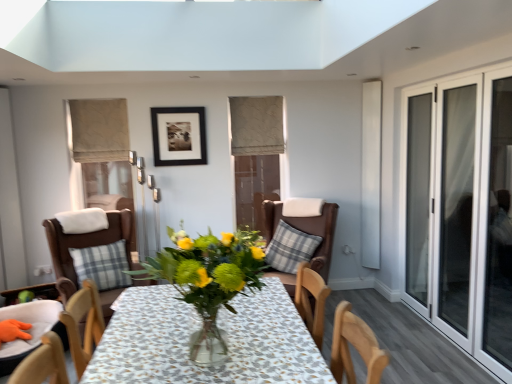
Find the location of a particular element. This screenshot has width=512, height=384. brown leather chair at left, the second chair in the right-to-left sequence is located at coordinates (93, 255).

What is the approximate height of wooden chair at lower left, which is counted as the 1th chair, starting from the left?

13.66 inches.

You are a GUI agent. You are given a task and a screenshot of the screen. Output one action in this format:
    pyautogui.click(x=<x>, y=<y>)
    Task: Click on the wooden chair at lower left, the third chair when ordered from right to left
    
    Given the screenshot: What is the action you would take?
    pyautogui.click(x=30, y=330)

The height and width of the screenshot is (384, 512). What do you see at coordinates (418, 195) in the screenshot? I see `transparent glass door at right` at bounding box center [418, 195].

Based on the photo, what is the approximate height of beige fabric curtain at upper left, which ranks as the 1th curtain in front-to-back order?

56.44 centimeters.

I want to click on beige fabric curtain at upper left, the second curtain positioned from the right, so click(x=99, y=130).

Where is `transparent glass screen door at right`? The image size is (512, 384). transparent glass screen door at right is located at coordinates (456, 204).

What do you see at coordinates (456, 204) in the screenshot? The image size is (512, 384). I see `transparent glass screen door at right` at bounding box center [456, 204].

Identify the location of transparent glass sliding door at right. coord(461,211).

The width and height of the screenshot is (512, 384). Identify the location of plaid fabric pillow at left, the 1th pillow positioned from the left. (102, 265).

In the scene shown: Can you see black matte picture frame at upper center touching brown leather chair at left, the second chair in the right-to-left sequence?

black matte picture frame at upper center and brown leather chair at left, the second chair in the right-to-left sequence, are not in contact.

How many degrees apart are the facing directions of black matte picture frame at upper center and brown leather chair at left, which is counted as the second chair, starting from the left?

The facing directions of black matte picture frame at upper center and brown leather chair at left, which is counted as the second chair, starting from the left, are 27.5 degrees apart.

Which is farther from the camera, (184, 162) or (89, 276)?

The point (184, 162) is farther.

You are a GUI agent. You are given a task and a screenshot of the screen. Output one action in this format:
    pyautogui.click(x=<x>, y=<y>)
    Task: Click on the chair that is the 2nd one when counting forward from the black matte picture frame at upper center
    This screenshot has height=384, width=512.
    Given the screenshot: What is the action you would take?
    pyautogui.click(x=93, y=255)

Considering the relative sizes of black matte picture frame at upper center and plaid fabric pillow at left, the 1th pillow positioned from the left, in the image provided, is black matte picture frame at upper center smaller than plaid fabric pillow at left, the 1th pillow positioned from the left,?

Correct, black matte picture frame at upper center occupies less space than plaid fabric pillow at left, the 1th pillow positioned from the left.

Would you say black matte picture frame at upper center is outside plaid fabric pillow at left, which is counted as the second pillow, starting from the right?

Indeed, black matte picture frame at upper center is completely outside plaid fabric pillow at left, which is counted as the second pillow, starting from the right.

From the image's perspective, is black matte picture frame at upper center positioned above or below plaid fabric pillow at left, the 1th pillow positioned from the left?

Clearly, from the image's perspective, black matte picture frame at upper center is above plaid fabric pillow at left, the 1th pillow positioned from the left.

Between black matte picture frame at upper center and plaid fabric pillow at left, the 1th pillow positioned from the left, which one has smaller width?

With smaller width is black matte picture frame at upper center.

Considering their positions, is plaid fabric pillow at left, the 1th pillow positioned from the left, located in front of or behind transparent glass sliding door at right?

plaid fabric pillow at left, the 1th pillow positioned from the left, is behind transparent glass sliding door at right.

Can you confirm if plaid fabric pillow at left, which is counted as the second pillow, starting from the right, is thinner than transparent glass sliding door at right?

Incorrect, the width of plaid fabric pillow at left, which is counted as the second pillow, starting from the right, is not less than that of transparent glass sliding door at right.

Can you confirm if plaid fabric pillow at left, the 1th pillow positioned from the left, is bigger than transparent glass sliding door at right?

No.

Identify the location of window that appears above the plaid fabric pillow at left, which is counted as the second pillow, starting from the right (from a real-world perspective). (461, 211).

Could you tell me if transparent glass screen door at right is turned towards beige fabric curtain at upper center, the first curtain in the right-to-left sequence?

No.

Which object is thinner, transparent glass screen door at right or beige fabric curtain at upper center, marked as the second curtain in a front-to-back arrangement?

Thinner between the two is transparent glass screen door at right.

Is transparent glass screen door at right in contact with beige fabric curtain at upper center, marked as the second curtain in a front-to-back arrangement?

There is a gap between transparent glass screen door at right and beige fabric curtain at upper center, marked as the second curtain in a front-to-back arrangement.

Who is shorter, transparent glass screen door at right or beige fabric curtain at upper center, which appears as the 2th curtain when viewed from the left?

beige fabric curtain at upper center, which appears as the 2th curtain when viewed from the left, is shorter.

How far apart are plaid fabric pillow at center, which is the first pillow in right-to-left order, and transparent glass screen door at right?

The distance of plaid fabric pillow at center, which is the first pillow in right-to-left order, from transparent glass screen door at right is 1.30 meters.

Is plaid fabric pillow at center, which is the first pillow in right-to-left order, wider or thinner than transparent glass screen door at right?

plaid fabric pillow at center, which is the first pillow in right-to-left order, is wider than transparent glass screen door at right.

From the image's perspective, which object appears higher, plaid fabric pillow at center, which is the first pillow in right-to-left order, or transparent glass screen door at right?

transparent glass screen door at right.

Which object is thinner, beige fabric curtain at upper left, the second curtain positioned from the right, or wooden chair at lower left, the third chair when ordered from right to left?

beige fabric curtain at upper left, the second curtain positioned from the right, is thinner.

From the picture: From the image's perspective, who appears lower, beige fabric curtain at upper left, which ranks as the 1th curtain in front-to-back order, or wooden chair at lower left, the third chair when ordered from right to left?

From the image's view, wooden chair at lower left, the third chair when ordered from right to left, is below.

Does beige fabric curtain at upper left, positioned as the 2th curtain in back-to-front order, appear on the right side of wooden chair at lower left, which is counted as the 1th chair, starting from the left?

Yes.

Consider the image. How much distance is there between beige fabric curtain at upper left, positioned as the 2th curtain in back-to-front order, and wooden chair at lower left, the third chair when ordered from right to left?

The distance of beige fabric curtain at upper left, positioned as the 2th curtain in back-to-front order, from wooden chair at lower left, the third chair when ordered from right to left, is 5.33 feet.

Considering the relative sizes of beige fabric curtain at upper center, the first curtain in the right-to-left sequence, and plaid fabric pillow at left, which is counted as the second pillow, starting from the right, in the image provided, is beige fabric curtain at upper center, the first curtain in the right-to-left sequence, thinner than plaid fabric pillow at left, which is counted as the second pillow, starting from the right,?

In fact, beige fabric curtain at upper center, the first curtain in the right-to-left sequence, might be wider than plaid fabric pillow at left, which is counted as the second pillow, starting from the right.

From the image's perspective, which object appears higher, beige fabric curtain at upper center, the first curtain in the right-to-left sequence, or plaid fabric pillow at left, which is counted as the second pillow, starting from the right?

beige fabric curtain at upper center, the first curtain in the right-to-left sequence, is shown above in the image.

Which object is closer to the camera, beige fabric curtain at upper center, the first curtain in the right-to-left sequence, or plaid fabric pillow at left, which is counted as the second pillow, starting from the right?

plaid fabric pillow at left, which is counted as the second pillow, starting from the right, is closer to the camera.

From a real-world perspective, which is physically below, beige fabric curtain at upper center, marked as the second curtain in a front-to-back arrangement, or plaid fabric pillow at left, the 1th pillow positioned from the left?

In real-world perspective, plaid fabric pillow at left, the 1th pillow positioned from the left, is lower.

Where is `picture frame above the brown leather chair at left, which is counted as the second chair, starting from the left (from a real-world perspective)`? picture frame above the brown leather chair at left, which is counted as the second chair, starting from the left (from a real-world perspective) is located at coordinates (179, 136).

Find the location of `picture frame on the right side of plaid fabric pillow at left, the 1th pillow positioned from the left`. picture frame on the right side of plaid fabric pillow at left, the 1th pillow positioned from the left is located at coordinates (179, 136).

From the image, which object appears to be nearer to plaid fabric pillow at center, which is the second pillow from left to right, beige fabric curtain at upper center, which is the first curtain from back to front, or brown leather chair at left, which is counted as the second chair, starting from the left?

beige fabric curtain at upper center, which is the first curtain from back to front.

Based on their spatial positions, is transparent glass door at right or beige fabric curtain at upper center, which is the first curtain from back to front, further from brown leather chair at center, which is counted as the third chair, starting from the left?

transparent glass door at right.

Consider the image. Considering their positions, is wooden chair at lower left, the third chair when ordered from right to left, positioned further to beige fabric curtain at upper center, which appears as the 2th curtain when viewed from the left, than plaid fabric pillow at center, which is the second pillow from left to right?

wooden chair at lower left, the third chair when ordered from right to left, is positioned further to the anchor beige fabric curtain at upper center, which appears as the 2th curtain when viewed from the left.

Looking at the image, which one is located closer to beige fabric curtain at upper left, which ranks as the 1th curtain in front-to-back order, black matte picture frame at upper center or transparent glass sliding door at right?

black matte picture frame at upper center.

Based on their spatial positions, is transparent glass door at right or transparent glass screen door at right closer to brown leather chair at left, the second chair in the right-to-left sequence?

Among the two, transparent glass door at right is located nearer to brown leather chair at left, the second chair in the right-to-left sequence.

Looking at the image, which one is located closer to plaid fabric pillow at center, which is the first pillow in right-to-left order, wooden chair at lower left, which is counted as the 1th chair, starting from the left, or beige fabric curtain at upper center, the first curtain in the right-to-left sequence?

beige fabric curtain at upper center, the first curtain in the right-to-left sequence.

Based on their spatial positions, is plaid fabric pillow at left, which is counted as the second pillow, starting from the right, or transparent glass screen door at right closer to beige fabric curtain at upper left, the second curtain positioned from the right?

plaid fabric pillow at left, which is counted as the second pillow, starting from the right, is positioned closer to the anchor beige fabric curtain at upper left, the second curtain positioned from the right.

Considering their positions, is beige fabric curtain at upper center, marked as the second curtain in a front-to-back arrangement, positioned closer to transparent glass sliding door at right than black matte picture frame at upper center?

Based on the image, beige fabric curtain at upper center, marked as the second curtain in a front-to-back arrangement, appears to be nearer to transparent glass sliding door at right.

Identify the location of glass door between wooden chair at lower left, which is counted as the 1th chair, starting from the left, and transparent glass sliding door at right from left to right. (418, 195).

Identify the location of pillow between black matte picture frame at upper center and transparent glass sliding door at right from left to right. Image resolution: width=512 pixels, height=384 pixels. (290, 248).

You are a GUI agent. You are given a task and a screenshot of the screen. Output one action in this format:
    pyautogui.click(x=<x>, y=<y>)
    Task: Click on the screen door between translucent glass vase at center and brown leather chair at center, which is the 1th chair from right to left, in the front-back direction
    Image resolution: width=512 pixels, height=384 pixels.
    Given the screenshot: What is the action you would take?
    [456, 204]

Find the location of a particular element. screen door positioned between translucent glass vase at center and black matte picture frame at upper center from near to far is located at coordinates (456, 204).